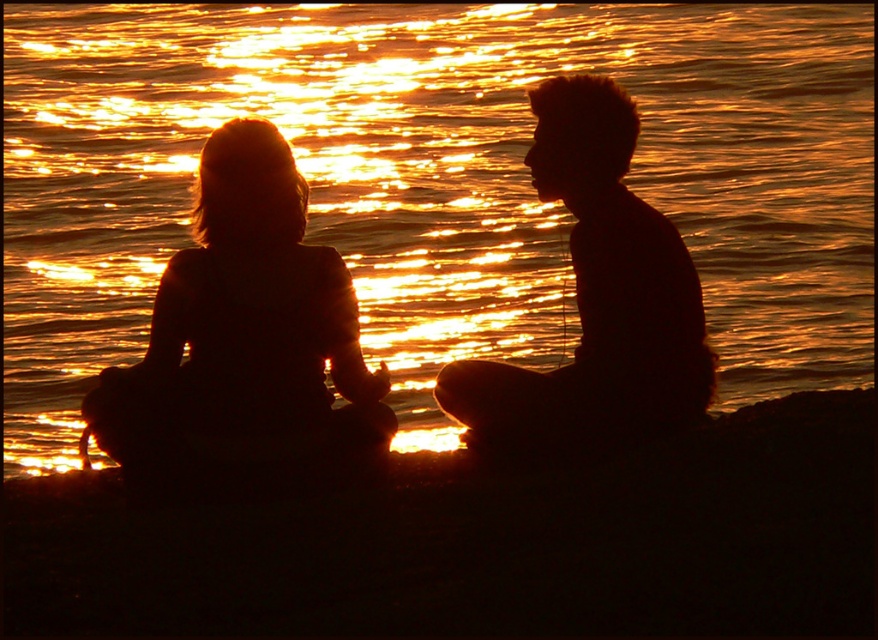
Who is higher up, golden reflective water at center or silhouette hair at left?

Positioned higher is golden reflective water at center.

Which is below, golden reflective water at center or silhouette hair at left?

Positioned lower is silhouette hair at left.

This screenshot has width=878, height=640. What do you see at coordinates (434, 180) in the screenshot? I see `golden reflective water at center` at bounding box center [434, 180].

The width and height of the screenshot is (878, 640). In order to click on golden reflective water at center in this screenshot , I will do `click(434, 180)`.

How much distance is there between silhouette hair at left and silhouette man at center?

A distance of 36.15 inches exists between silhouette hair at left and silhouette man at center.

Between point (164, 324) and point (668, 397), which one is positioned behind?

Point (668, 397)

Does point (131, 365) come farther from viewer compared to point (511, 396)?

Yes, it is.

Identify the location of silhouette hair at left. (245, 340).

Between golden reflective water at center and silhouette man at center, which one has more height?

golden reflective water at center

This screenshot has width=878, height=640. Describe the element at coordinates (434, 180) in the screenshot. I see `golden reflective water at center` at that location.

Where is `golden reflective water at center`? The image size is (878, 640). golden reflective water at center is located at coordinates (434, 180).